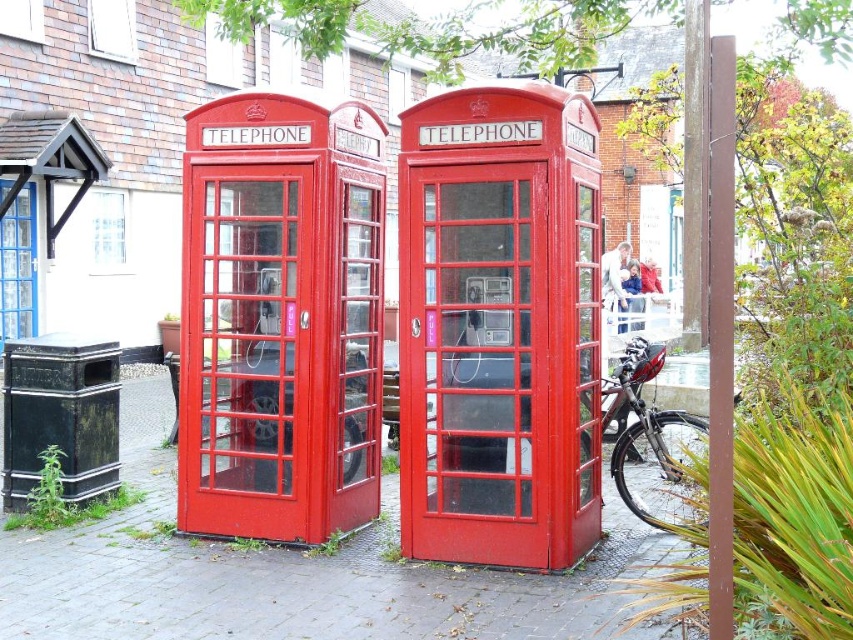
Find the location of a particular element. This screenshot has width=853, height=640. shiny black bicycle at center is located at coordinates (641, 416).

Based on the photo, which is above, shiny black bicycle at center or matte glass telephone booth at center?

matte glass telephone booth at center

Which is behind, point (637, 369) or point (491, 324)?

Point (637, 369)

Find the location of a particular element. shiny black bicycle at center is located at coordinates (641, 416).